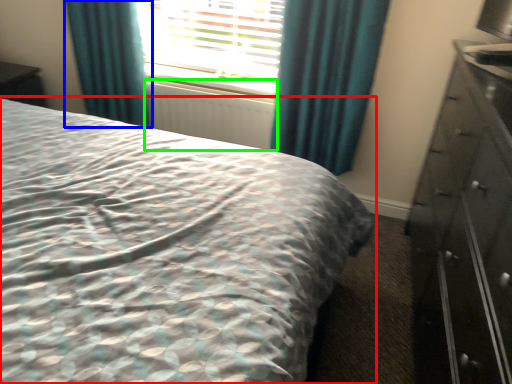
Question: Which object is the farthest from bed (highlighted by a red box)? Choose among these: curtain (highlighted by a blue box) or radiator (highlighted by a green box).

Choices:
 (A) curtain
 (B) radiator

Answer: (A)